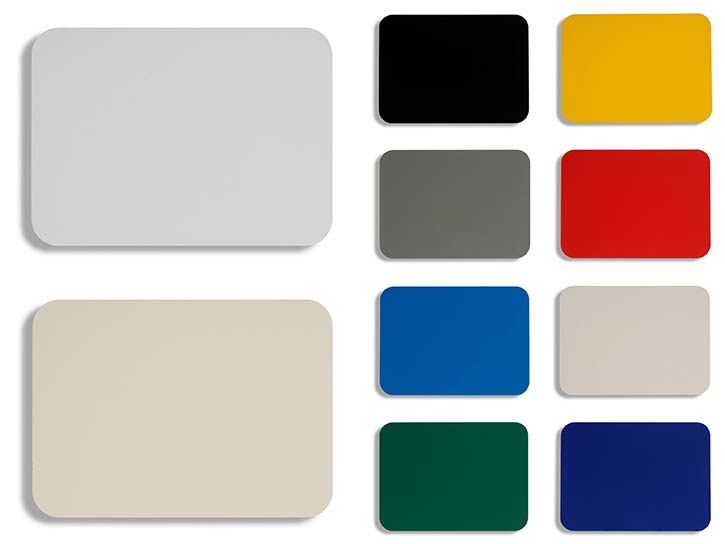
You are a GUI agent. You are given a task and a screenshot of the screen. Output one action in this format:
    pyautogui.click(x=<x>, y=<y>)
    Task: Click on the tile to right of green tile
    
    Given the screenshot: What is the action you would take?
    pyautogui.click(x=650, y=459)